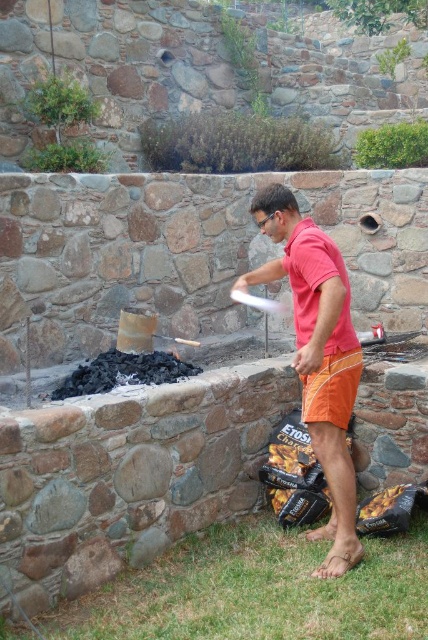
Question: Which object is the closest to the orange fabric shorts at center?

Choices:
 (A) matte red shirt at center
 (B) black charcoal at lower left

Answer: (A)

Question: Which point is closer to the camera?

Choices:
 (A) (351, 353)
 (B) (308, 314)
 (C) (166, 364)

Answer: (A)

Question: Can you confirm if matte red shirt at center is smaller than orange fabric shorts at center?

Choices:
 (A) yes
 (B) no

Answer: (B)

Question: Which point is closer to the camera taking this photo?

Choices:
 (A) (347, 417)
 (B) (98, 358)

Answer: (A)

Question: Is the position of black charcoal at lower left more distant than that of orange fabric shorts at center?

Choices:
 (A) no
 (B) yes

Answer: (B)

Question: Is matte red shirt at center thinner than black charcoal at lower left?

Choices:
 (A) yes
 (B) no

Answer: (A)